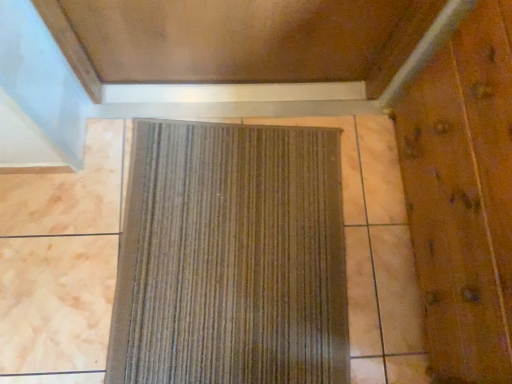
Find the location of a particular element. The width and height of the screenshot is (512, 384). vacant space underneath brown textured mat at center (from a real-world perspective) is located at coordinates (241, 252).